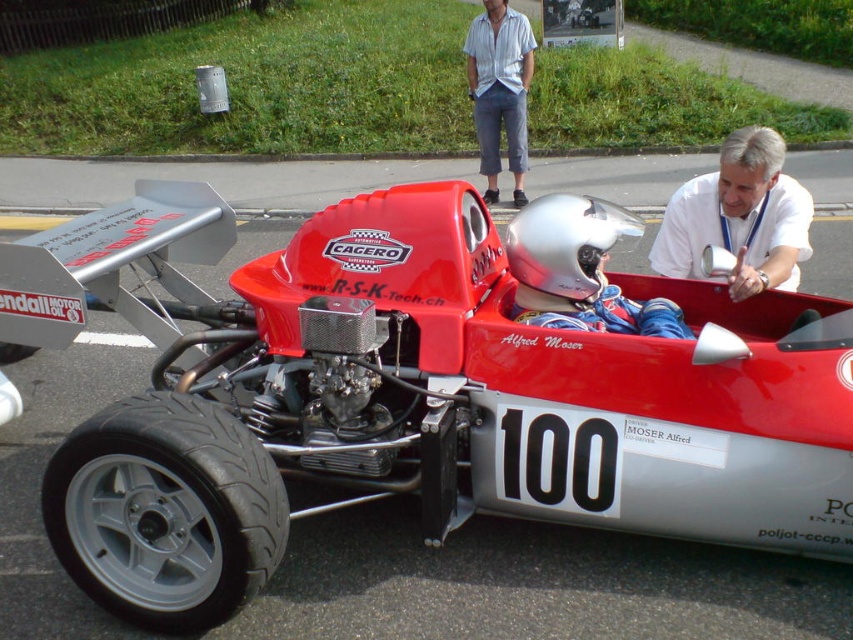
You are a photographer at the motorsport event and want to capture a photo that includes both the white lanyard at upper center and the silver metallic helmet at center. Which object should you focus on first if you want to ensure both are in the frame without moving the camera?

The white lanyard at upper center has a greater height compared to the silver metallic helmet at center, so focusing on the taller white lanyard at upper center first will help ensure both objects are within the frame.

You are a photographer at the motorsport event and need to capture a photo that includes both the silver metallic helmet at center and the light blue cotton shirt at upper center. Based on their positions, which object should you focus on first to ensure both are in the frame?

The silver metallic helmet at center is located below the light blue cotton shirt at upper center. To include both in the frame, focus on the light blue cotton shirt at upper center first as it is higher up, then adjust the camera angle to include the helmet below it.

You are a photographer at the event and need to capture both the white lanyard at upper center and the silver metallic helmet at center in a single frame. Which object should you focus on first to ensure both are in the frame without moving the camera?

The white lanyard at upper center has a larger size compared to the silver metallic helmet at center, so you should focus on the white lanyard at upper center first to ensure both are in the frame without moving the camera.